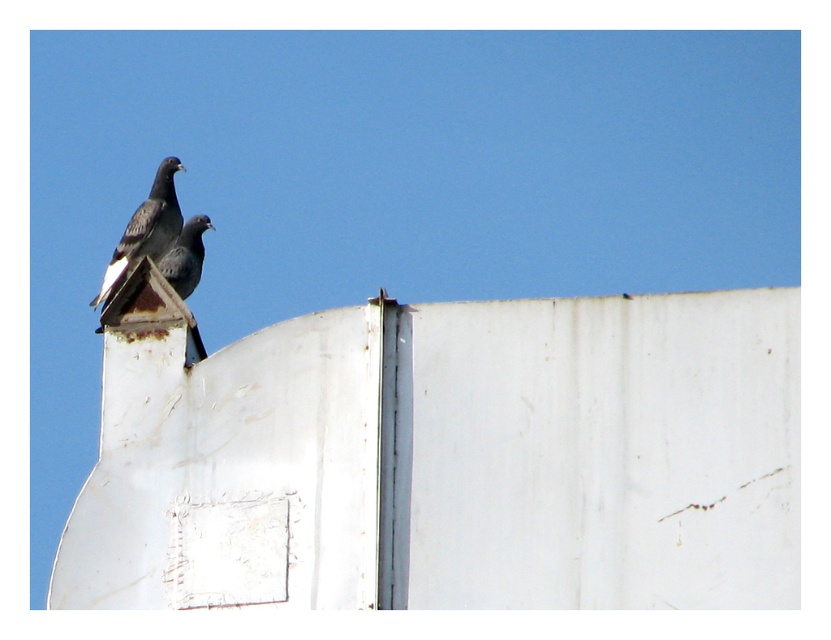
You are standing 100 meters away from a white corrugated metal structure with a curved top. You see a dark gray matte pigeon at upper left perched there. Can you confirm if the pigeon is within your visible range?

The dark gray matte pigeon at upper left is 90.22 meters away from viewer, so yes, it is within your visible range since it is closer than 100 meters.

You are a birdwatcher standing 5 meters away from the white structure where the dark gray matte pigeon at upper left and the matte black pigeon at center are perched. You want to observe both pigeons clearly through your binoculars. Can you see both pigeons at the same time with your binoculars which have a 6 meter field of view?

The dark gray matte pigeon at upper left and the matte black pigeon at center are 3.92 meters apart from each other. Since your binoculars have a 6 meter field of view, which is wider than the distance between them, you can see both pigeons at the same time.

You are standing 100 meters away from a white corrugated metal structure with two pigeons. You want to know how far you need to walk forward to reach the point marked at coordinates point (120, 244). Can you calculate the distance you need to walk?

The point (120, 244) is 108.65 meters away from the viewer. Since you are currently 100 meters away, you need to walk an additional 8.65 meters forward to reach the point marked at coordinates point (120, 244).